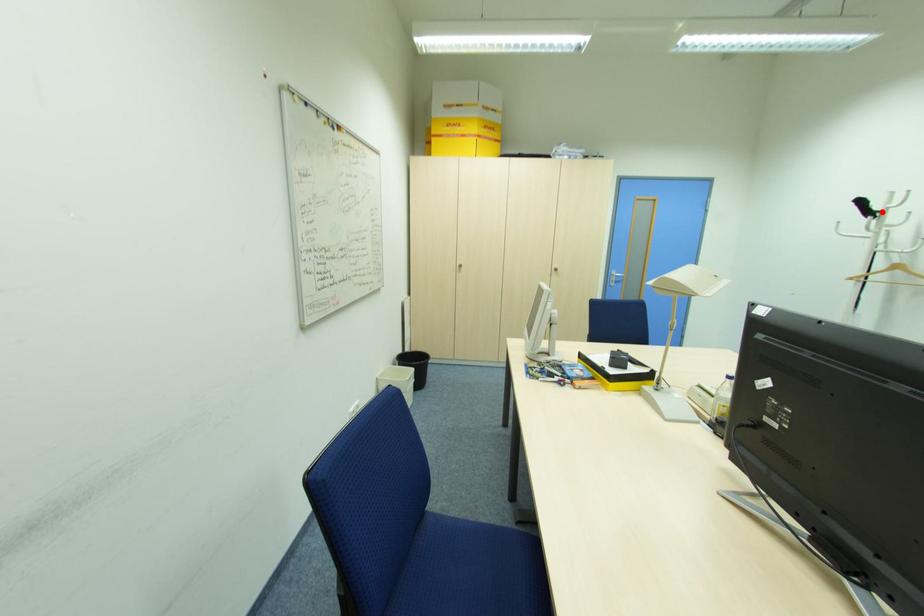
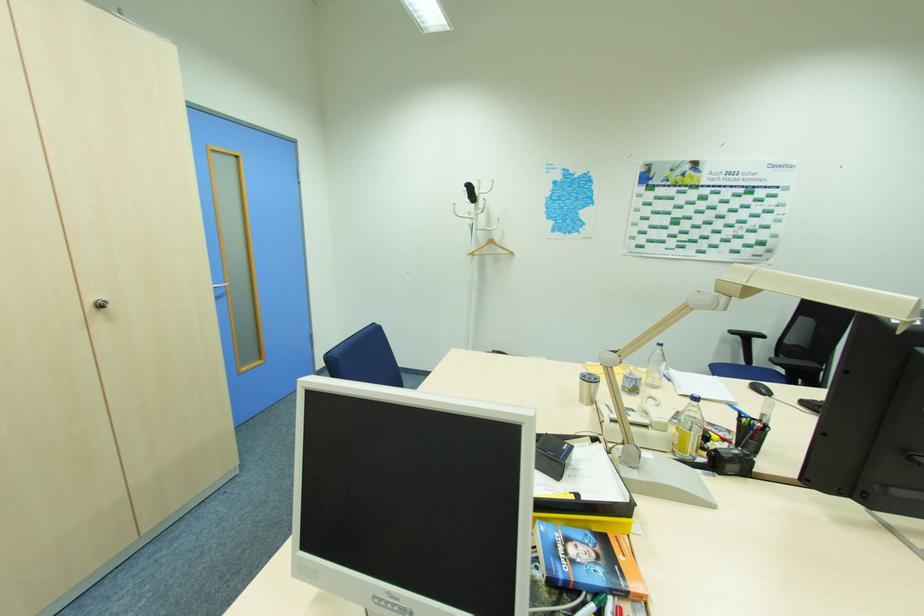
Locate, in the second image, the point that corresponds to the highlighted location in the first image.

(479, 197)